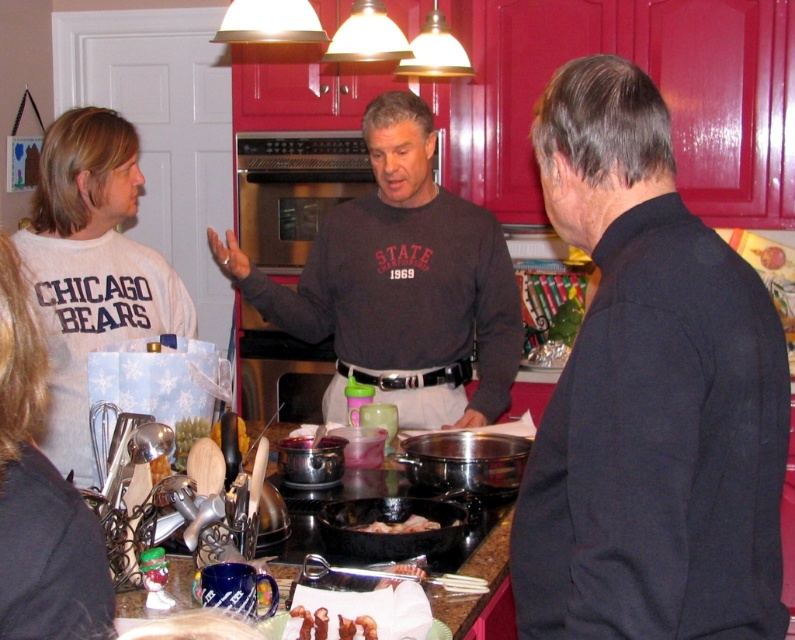
Question: In this image, where is dark gray sweatshirt at center located relative to shiny golden fries at center?

Choices:
 (A) right
 (B) left

Answer: (A)

Question: Which point is farther to the camera?

Choices:
 (A) coord(320,618)
 (B) coord(64,556)
 (C) coord(47,442)
 (D) coord(398,532)

Answer: (C)

Question: Where is black matte jacket at right located in relation to white fabric shirt at left in the image?

Choices:
 (A) above
 (B) below

Answer: (A)

Question: Is white cotton t-shirt at left further to the viewer compared to golden crispy bacon at center?

Choices:
 (A) yes
 (B) no

Answer: (A)

Question: Which object appears closest to the camera in this image?

Choices:
 (A) golden crispy bacon at center
 (B) shiny golden fries at center
 (C) black matte jacket at right
 (D) white cotton t-shirt at left

Answer: (C)

Question: Which point is farther to the camera?

Choices:
 (A) white cotton t-shirt at left
 (B) black matte jacket at right
 (C) golden crispy bacon at center
 (D) white fabric shirt at left

Answer: (A)